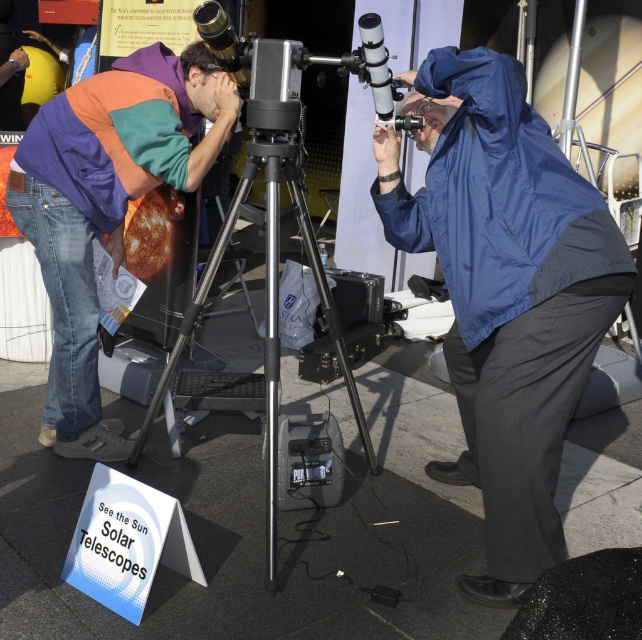
Question: Is multicolored fleece jacket at left below blue smooth jacket at center?

Choices:
 (A) no
 (B) yes

Answer: (B)

Question: Is blue smooth jacket at center below silver metallic tripod at center?

Choices:
 (A) yes
 (B) no

Answer: (B)

Question: Which point is farther from the camera taking this photo?

Choices:
 (A) (594, 196)
 (B) (58, 147)

Answer: (B)

Question: Does blue smooth jacket at center have a greater width compared to silver metallic tripod at center?

Choices:
 (A) yes
 (B) no

Answer: (B)

Question: Based on their relative distances, which object is nearer to the blue smooth jacket at center?

Choices:
 (A) multicolored fleece jacket at left
 (B) silver metallic tripod at center

Answer: (B)

Question: Estimate the real-world distances between objects in this image. Which object is farther from the multicolored fleece jacket at left?

Choices:
 (A) silver metallic tripod at center
 (B) blue smooth jacket at center

Answer: (B)